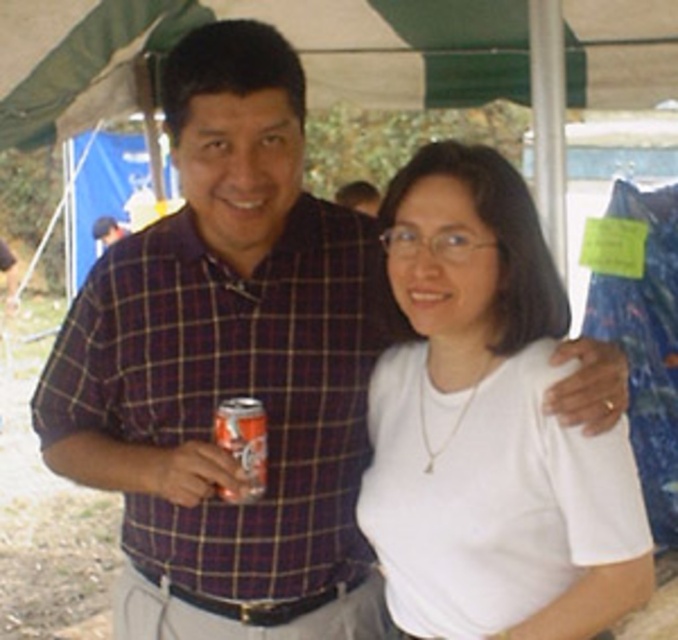
Who is shorter, orange aluminum can at center or plaid fabric shirt at center?

With less height is orange aluminum can at center.

Does point (218, 444) come in front of point (14, 296)?

Yes, it is.

You are a GUI agent. You are given a task and a screenshot of the screen. Output one action in this format:
    pyautogui.click(x=<x>, y=<y>)
    Task: Click on the orange aluminum can at center
    
    Given the screenshot: What is the action you would take?
    pyautogui.click(x=241, y=444)

Is white matte shirt at center bigger than orange aluminum can at center?

Indeed, white matte shirt at center has a larger size compared to orange aluminum can at center.

Does white matte shirt at center appear on the left side of orange aluminum can at center?

In fact, white matte shirt at center is to the right of orange aluminum can at center.

The height and width of the screenshot is (640, 678). In order to click on white matte shirt at center in this screenshot , I will do `click(487, 426)`.

Which of these two, plaid cotton shirt at center or orange aluminum can at center, stands shorter?

Standing shorter between the two is orange aluminum can at center.

Locate an element on the screen. This screenshot has height=640, width=678. plaid cotton shirt at center is located at coordinates (235, 392).

You are a GUI agent. You are given a task and a screenshot of the screen. Output one action in this format:
    pyautogui.click(x=<x>, y=<y>)
    Task: Click on the plaid cotton shirt at center
    
    Given the screenshot: What is the action you would take?
    pyautogui.click(x=235, y=392)